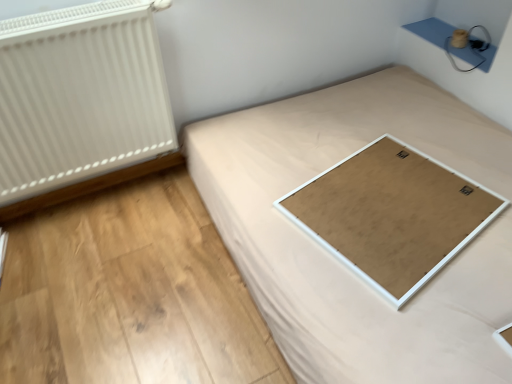
Locate an element on the screen. This screenshot has width=512, height=384. vacant space to the left of white matte board at center is located at coordinates (266, 189).